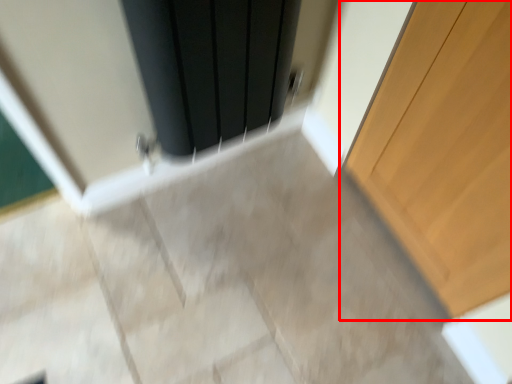
Question: Where is door (annotated by the red box) located in relation to screen door in the image?

Choices:
 (A) left
 (B) right

Answer: (B)